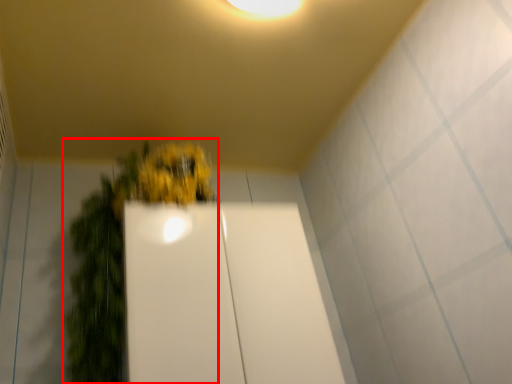
Question: Observing the image, what is the correct spatial positioning of houseplant (annotated by the red box) in reference to glass door?

Choices:
 (A) left
 (B) right

Answer: (A)